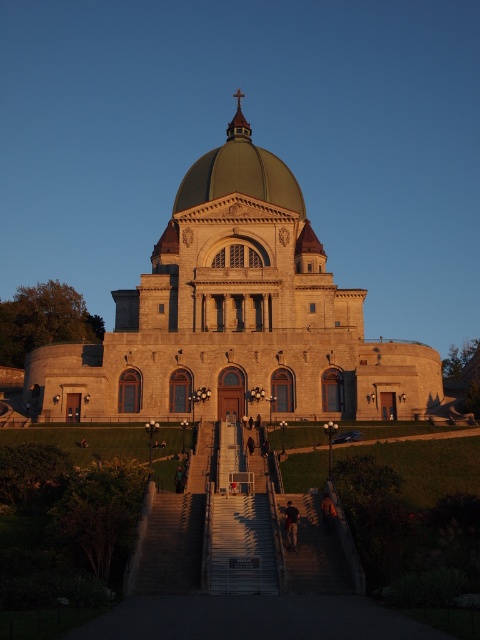
Is stone church at center bigger than green matte dome at center?

Indeed, stone church at center has a larger size compared to green matte dome at center.

Is stone church at center shorter than green matte dome at center?

No.

Does point (389, 404) lie in front of point (273, 154)?

Yes, it is.

This screenshot has height=640, width=480. In order to click on stone church at center in this screenshot , I will do `click(236, 316)`.

Does green matte dome at center have a lesser width compared to dark blue jeans at center?

No, green matte dome at center is not thinner than dark blue jeans at center.

Looking at this image, who is positioned more to the right, green matte dome at center or dark blue jeans at center?

dark blue jeans at center is more to the right.

Measure the distance between point (x=237, y=90) and camera.

Point (x=237, y=90) and camera are 190.36 meters apart.

Find the location of a particular element. The width and height of the screenshot is (480, 640). green matte dome at center is located at coordinates (240, 172).

Is stone church at center thinner than dark blue jeans at center?

No, stone church at center is not thinner than dark blue jeans at center.

Does stone church at center lie behind dark blue jeans at center?

Yes, it is behind dark blue jeans at center.

This screenshot has width=480, height=640. Identify the location of stone church at center. (236, 316).

Image resolution: width=480 pixels, height=640 pixels. I want to click on stone church at center, so click(x=236, y=316).